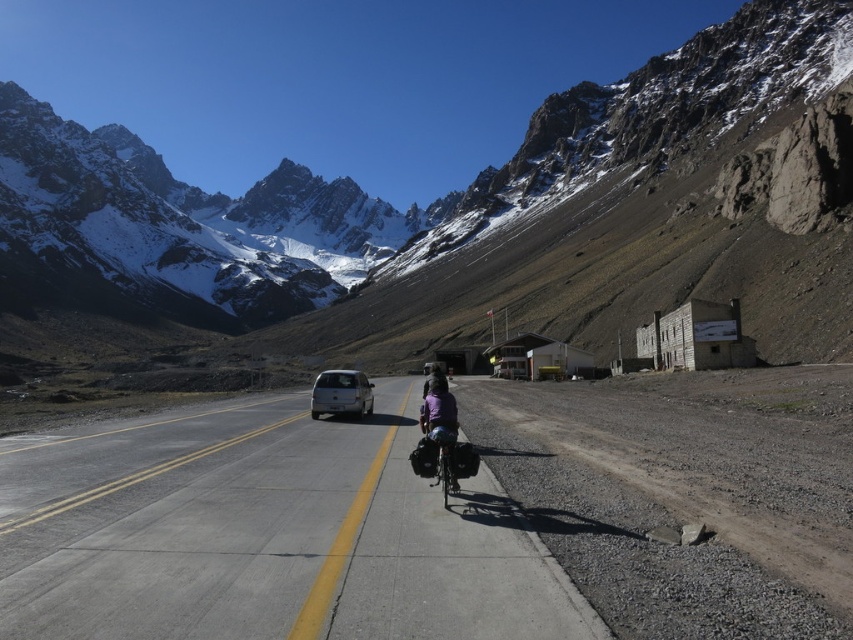
Does snowy rocky mountain range at upper center have a larger size compared to metallic silver bicycle at center?

Yes.

Does point (42, 268) come in front of point (456, 445)?

No, it is not.

This screenshot has height=640, width=853. What are the coordinates of `snowy rocky mountain range at upper center` in the screenshot? It's located at (476, 204).

Who is more forward, (561, 312) or (332, 490)?

Point (332, 490) is in front.

Is snowy rocky mountain range at upper center positioned before asphalt road at center?

No, it is behind asphalt road at center.

Is point (842, 164) closer to camera compared to point (378, 612)?

No, (842, 164) is further to viewer.

I want to click on snowy rocky mountain range at upper center, so click(476, 204).

In the scene shown: Is snowy rocky mountain range at upper center in front of silver metallic van at center?

No, it is behind silver metallic van at center.

Between point (80, 172) and point (317, 406), which one is positioned behind?

The point (80, 172) is behind.

Find the location of a particular element. This screenshot has width=853, height=640. snowy rocky mountain range at upper center is located at coordinates (476, 204).

At what (x,y) coordinates should I click in order to perform the action: click on snowy rocky mountain range at upper center. Please return your answer as a coordinate pair (x, y). The width and height of the screenshot is (853, 640). Looking at the image, I should click on (476, 204).